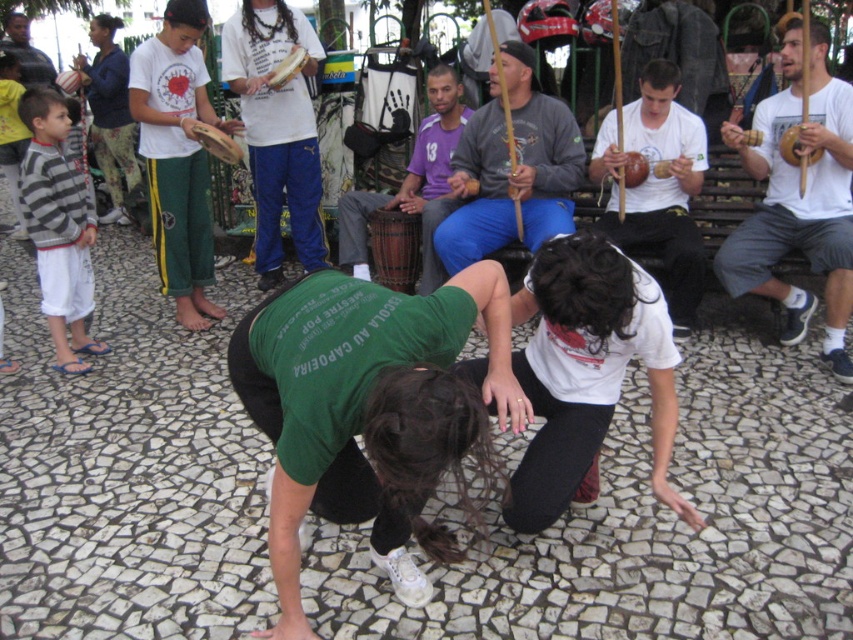
You are a photographer setting up a shot of the Capoeira performance. You have a camera with a lens that can only focus on objects thicker than 5 cm. Given the white matte coconut shell at center and the matte green shirt at center, which object will your camera focus on?

The matte green shirt at center is thicker than the white matte coconut shell at center, so the camera will focus on the matte green shirt at center since it meets the minimum thickness requirement of 5 cm.

You are a photographer at the Capoeira event. You want to take a photo that includes both the white matte coconut shell at center and the matte green shirt at center. Based on their positions, which object should you adjust your camera angle to focus on first to ensure both are in frame?

The white matte coconut shell at center is to the right of the matte green shirt at center. To capture both in the frame, focus on the matte green shirt at center first, then adjust the camera angle to include the white matte coconut shell at center positioned to its right.

You are a photographer preparing to capture a group photo of the Capoeira participants. You need to position yourself between the white matte drum at right and the striped sweater at left. What is the minimum distance you should maintain between these two objects to ensure everyone fits in the frame?

The minimum distance you should maintain between the white matte drum at right and the striped sweater at left is 3.50 meters to ensure everyone fits in the frame.